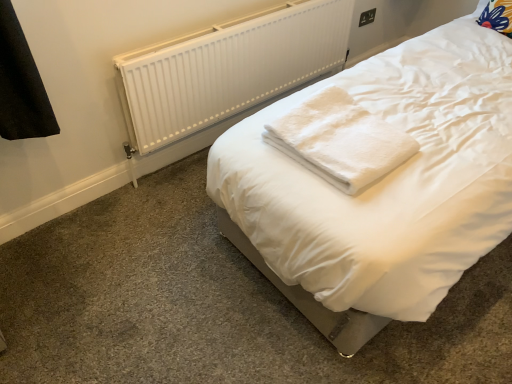
Question: Is black plastic electric outlet at upper right not within white fluffy towel at center?

Choices:
 (A) yes
 (B) no

Answer: (A)

Question: From a real-world perspective, does black plastic electric outlet at upper right sit lower than white fluffy towel at center?

Choices:
 (A) no
 (B) yes

Answer: (B)

Question: Considering the relative sizes of black plastic electric outlet at upper right and white fluffy towel at center in the image provided, is black plastic electric outlet at upper right thinner than white fluffy towel at center?

Choices:
 (A) no
 (B) yes

Answer: (B)

Question: Can you confirm if black plastic electric outlet at upper right is smaller than white fluffy towel at center?

Choices:
 (A) yes
 (B) no

Answer: (A)

Question: Are black plastic electric outlet at upper right and white fluffy towel at center located far from each other?

Choices:
 (A) no
 (B) yes

Answer: (B)

Question: Considering the relative positions of black plastic electric outlet at upper right and white fluffy towel at center in the image provided, is black plastic electric outlet at upper right to the left of white fluffy towel at center from the viewer's perspective?

Choices:
 (A) no
 (B) yes

Answer: (A)

Question: Can you confirm if black plastic electric outlet at upper right is positioned to the right of white plastic radiator at upper center?

Choices:
 (A) no
 (B) yes

Answer: (B)

Question: Is black plastic electric outlet at upper right positioned before white plastic radiator at upper center?

Choices:
 (A) yes
 (B) no

Answer: (B)

Question: From a real-world perspective, is black plastic electric outlet at upper right positioned under white plastic radiator at upper center based on gravity?

Choices:
 (A) no
 (B) yes

Answer: (A)

Question: Does black plastic electric outlet at upper right touch white plastic radiator at upper center?

Choices:
 (A) no
 (B) yes

Answer: (A)

Question: Considering the relative sizes of black plastic electric outlet at upper right and white plastic radiator at upper center in the image provided, is black plastic electric outlet at upper right smaller than white plastic radiator at upper center?

Choices:
 (A) no
 (B) yes

Answer: (B)

Question: Is there a large distance between black plastic electric outlet at upper right and white plastic radiator at upper center?

Choices:
 (A) no
 (B) yes

Answer: (B)

Question: Could you tell me if white fluffy towel at center is turned towards black plastic electric outlet at upper right?

Choices:
 (A) no
 (B) yes

Answer: (A)